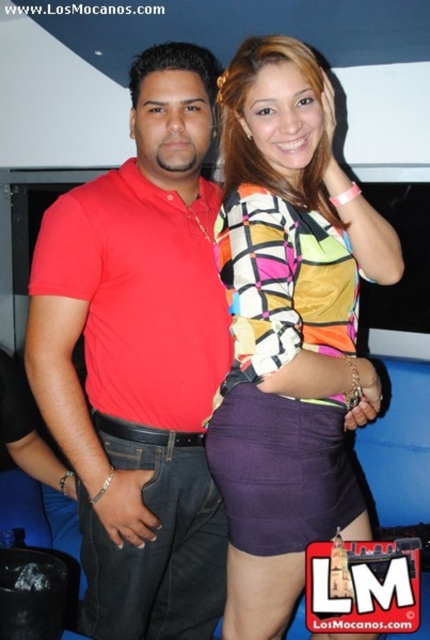
Between point (193, 321) and point (229, 384), which one is positioned in front?

Positioned in front is point (229, 384).

Who is positioned more to the right, matte red polo shirt at center or purple satin skirt at center?

purple satin skirt at center is more to the right.

Describe the element at coordinates (141, 358) in the screenshot. I see `matte red polo shirt at center` at that location.

The image size is (430, 640). In order to click on matte red polo shirt at center in this screenshot , I will do `click(141, 358)`.